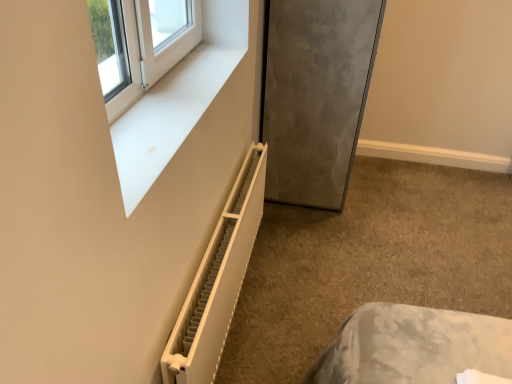
Question: Is white matte radiator at lower left taller or shorter than satin gray refrigerator at lower right?

Choices:
 (A) tall
 (B) short

Answer: (B)

Question: Is white matte radiator at lower left in front of or behind satin gray refrigerator at lower right in the image?

Choices:
 (A) behind
 (B) front

Answer: (B)

Question: Based on their relative distances, which object is farther from the white plastic window frame at upper left?

Choices:
 (A) satin gray refrigerator at lower right
 (B) white plastic radiator at lower left
 (C) white matte radiator at lower left

Answer: (C)

Question: Considering the real-world distances, which object is closest to the white plastic radiator at lower left?

Choices:
 (A) white plastic window frame at upper left
 (B) white matte radiator at lower left
 (C) satin gray refrigerator at lower right

Answer: (A)